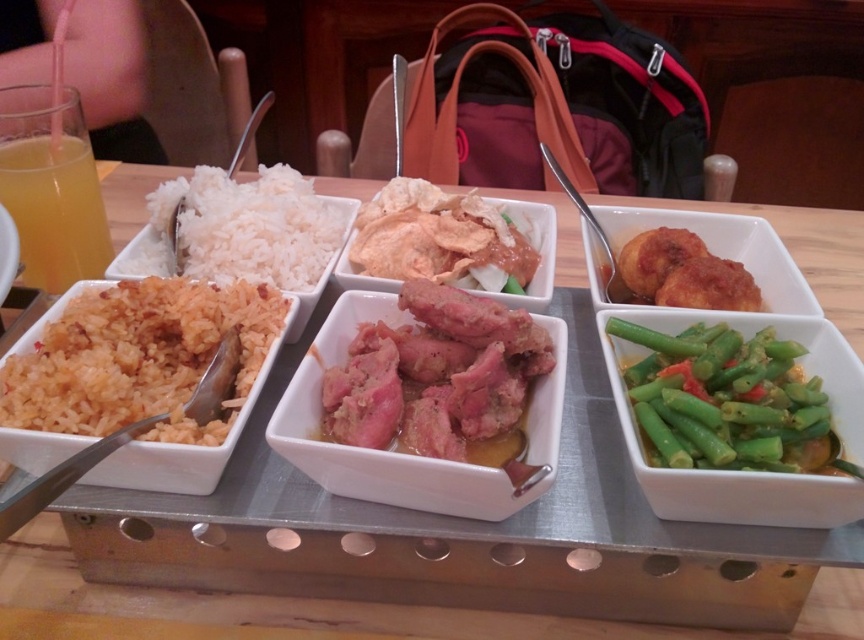
Question: Where is orange rice at left located in relation to pinkish-brown meat at center in the image?

Choices:
 (A) below
 (B) above

Answer: (B)

Question: Considering the relative positions of orange rice at left and pinkish-brown meat at center in the image provided, where is orange rice at left located with respect to pinkish-brown meat at center?

Choices:
 (A) right
 (B) left

Answer: (B)

Question: Based on their relative distances, which object is farther from the orange rice at left?

Choices:
 (A) shiny brown meat at center
 (B) pinkish-brown meat at center
 (C) translucent glass at upper left
 (D) white matte rice at upper left

Answer: (C)

Question: Among these objects, which one is farthest from the camera?

Choices:
 (A) white ceramic tray at center
 (B) white matte rice at upper left
 (C) shiny brown meat at center

Answer: (C)

Question: Among these objects, which one is farthest from the camera?

Choices:
 (A) pinkish-brown meat at center
 (B) green glossy beans at lower right

Answer: (A)

Question: Is orange rice at left positioned at the back of green glossy beans at lower right?

Choices:
 (A) yes
 (B) no

Answer: (A)